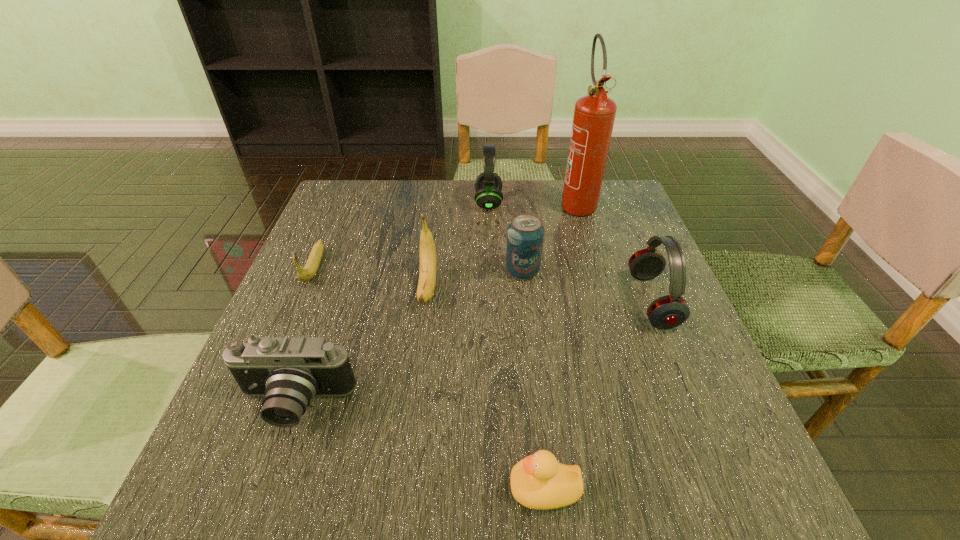
Find the location of a particular element. Image resolution: width=960 pixels, height=540 pixels. vacant space located from the nozzle of the fire extinguisher is located at coordinates (594, 259).

This screenshot has width=960, height=540. In order to click on vacant space located 0.070m on the ear cups of the headset in this screenshot , I will do [448, 202].

This screenshot has width=960, height=540. Identify the location of free location located on the ear cups of the headset. (423, 202).

You are a GUI agent. You are given a task and a screenshot of the screen. Output one action in this format:
    pyautogui.click(x=<x>, y=<y>)
    Task: Click on the vacant point located 0.110m on the ear cups of the headset
    
    Given the screenshot: What is the action you would take?
    pyautogui.click(x=434, y=202)

This screenshot has width=960, height=540. I want to click on free space located at the start of the peel on the taller banana, so click(x=408, y=446).

Locate an element on the screen. Image resolution: width=960 pixels, height=540 pixels. free location located 0.100m on the ear cups of the rightmost object is located at coordinates (586, 301).

Find the location of `blank area located 0.310m on the ear cups of the rightmost object`. blank area located 0.310m on the ear cups of the rightmost object is located at coordinates (x=485, y=301).

Where is `vacant region located 0.260m on the ear cups of the rightmost object`? The image size is (960, 540). vacant region located 0.260m on the ear cups of the rightmost object is located at coordinates (509, 301).

Locate an element on the screen. The width and height of the screenshot is (960, 540). vacant space situated 0.160m on the right of the pop soda is located at coordinates (611, 271).

The height and width of the screenshot is (540, 960). In order to click on free spot located 0.090m on the front-facing side of the seventh farthest object in this screenshot , I will do `click(264, 493)`.